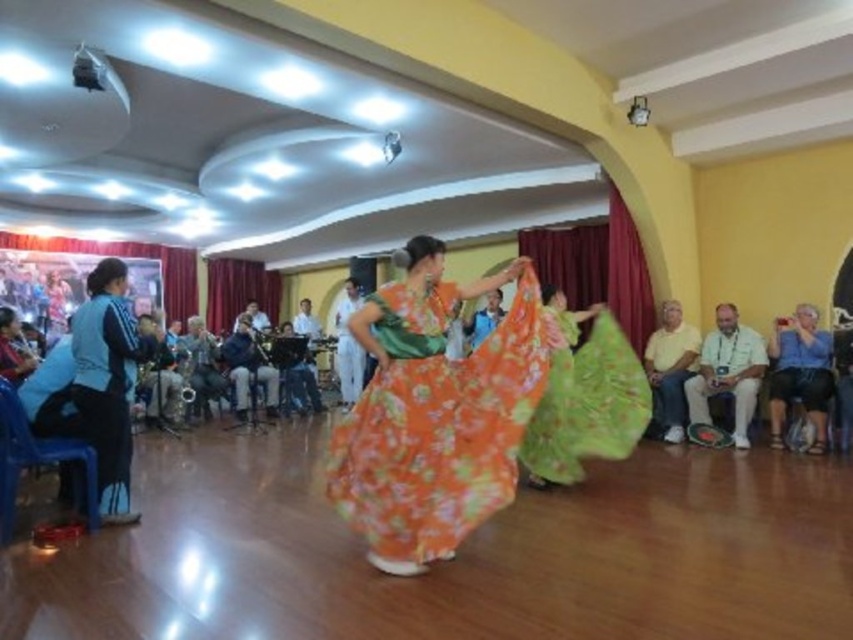
Question: Can you confirm if white fabric at right is positioned above satin fabric saxophone at center?

Choices:
 (A) no
 (B) yes

Answer: (A)

Question: Does denim jacket at center appear under satin fabric saxophone at center?

Choices:
 (A) yes
 (B) no

Answer: (A)

Question: Is white fabric at right below dark blue fabric at center?

Choices:
 (A) no
 (B) yes

Answer: (B)

Question: Which object is closer to the camera taking this photo?

Choices:
 (A) blue fleece vest at left
 (B) white fabric at right
 (C) blue denim jeans at right
 (D) satin fabric saxophone at center

Answer: (A)

Question: Which point is farther to the camera?

Choices:
 (A) (163, 385)
 (B) (445, 500)

Answer: (A)

Question: Which object appears closest to the camera in this image?

Choices:
 (A) blue denim jeans at right
 (B) blue fleece vest at left
 (C) matte black saxophone at center

Answer: (B)